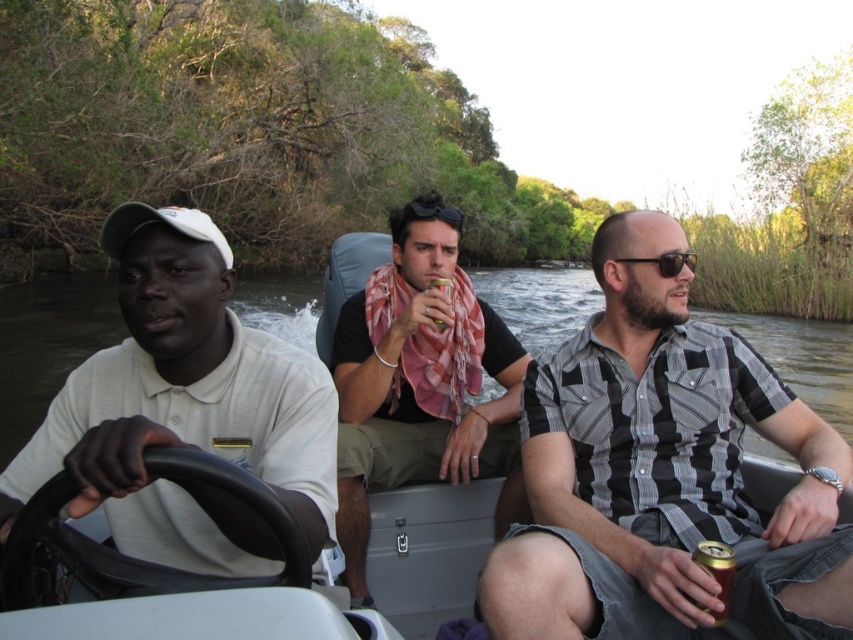
Question: Among these points, which one is farthest from the camera?

Choices:
 (A) (665, 252)
 (B) (355, 477)
 (C) (813, 557)

Answer: (B)

Question: Does white matte shirt at left have a smaller size compared to gold metallic can at lower right?

Choices:
 (A) yes
 (B) no

Answer: (B)

Question: Does smooth plastic boat at center appear on the right side of pink scarf at center?

Choices:
 (A) yes
 (B) no

Answer: (A)

Question: Does pink scarf at center come behind sunglasses at center?

Choices:
 (A) no
 (B) yes

Answer: (B)

Question: Which of these objects is positioned closest to the checkered fabric shirt at center?

Choices:
 (A) pink scarf at center
 (B) gold metallic can at lower right
 (C) smooth plastic boat at center

Answer: (B)

Question: Which point is farther from the camera taking this photo?

Choices:
 (A) (677, 269)
 (B) (706, 545)
 (C) (280, 563)

Answer: (A)